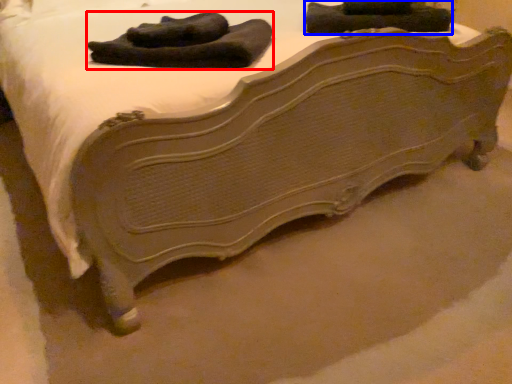
Question: Which point is further to the camera, laundry (highlighted by a red box) or clothing (highlighted by a blue box)?

Choices:
 (A) laundry
 (B) clothing

Answer: (B)